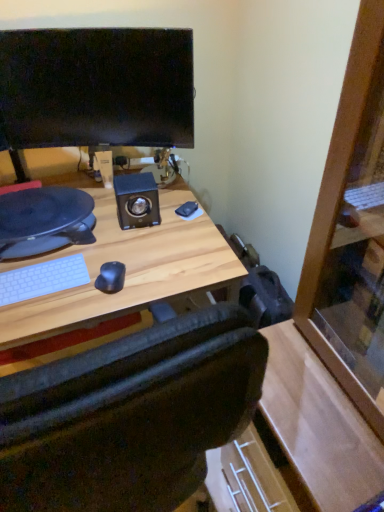
You are a GUI agent. You are given a task and a screenshot of the screen. Output one action in this format:
    pyautogui.click(x=<x>, y=<y>)
    Task: Click on the matte black monitor at upper left
    The height and width of the screenshot is (512, 384).
    Given the screenshot: What is the action you would take?
    96,88

The height and width of the screenshot is (512, 384). What do you see at coordinates (96, 88) in the screenshot?
I see `matte black monitor at upper left` at bounding box center [96, 88].

What is the approximate height of matte black monitor at upper left?

The height of matte black monitor at upper left is 14.37 inches.

This screenshot has width=384, height=512. In order to click on matte black monitor at upper left in this screenshot , I will do `click(96, 88)`.